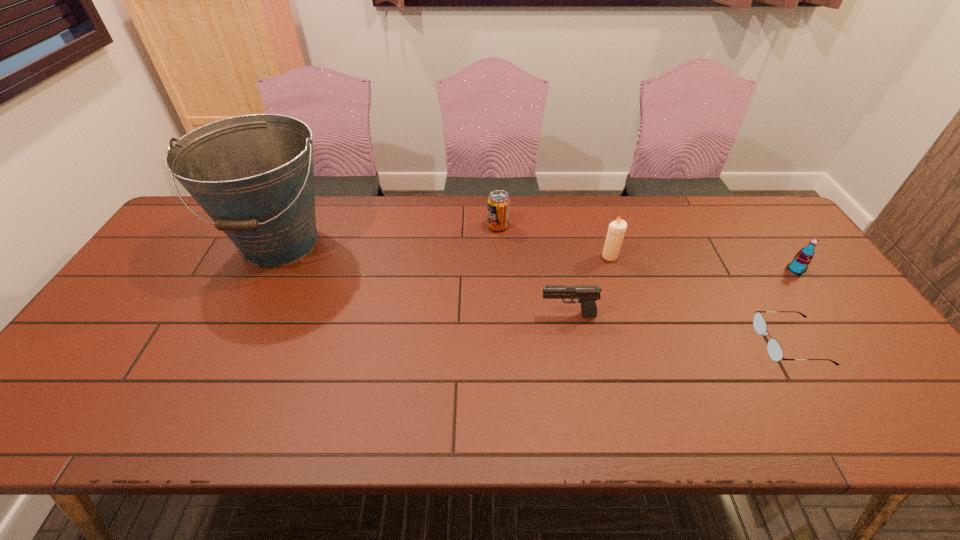
Find the location of `free spot located on the lenses of the nearest object`. free spot located on the lenses of the nearest object is located at coordinates (681, 343).

Image resolution: width=960 pixels, height=540 pixels. In order to click on free space located on the lenses of the nearest object in this screenshot , I will do `click(684, 343)`.

Locate an element on the screen. Image resolution: width=960 pixels, height=540 pixels. bucket at the far edge is located at coordinates (253, 175).

Identify the location of soda can at the far edge. Image resolution: width=960 pixels, height=540 pixels. pos(498,204).

This screenshot has height=540, width=960. In order to click on soda located in the right edge section of the desktop in this screenshot , I will do `click(800, 262)`.

Locate an element on the screen. spectacles located in the right edge section of the desktop is located at coordinates click(x=775, y=351).

What are the coordinates of `free space at the far edge of the desktop` in the screenshot? It's located at (479, 228).

Where is `vacant space at the near edge of the desktop`? This screenshot has width=960, height=540. vacant space at the near edge of the desktop is located at coordinates (581, 410).

Locate an element on the screen. The image size is (960, 540). vacant space at the left edge of the desktop is located at coordinates (74, 370).

At what (x,y) coordinates should I click in order to perform the action: click on vacant space at the right edge of the desktop. Please return your answer as a coordinate pair (x, y). Looking at the image, I should click on (799, 306).